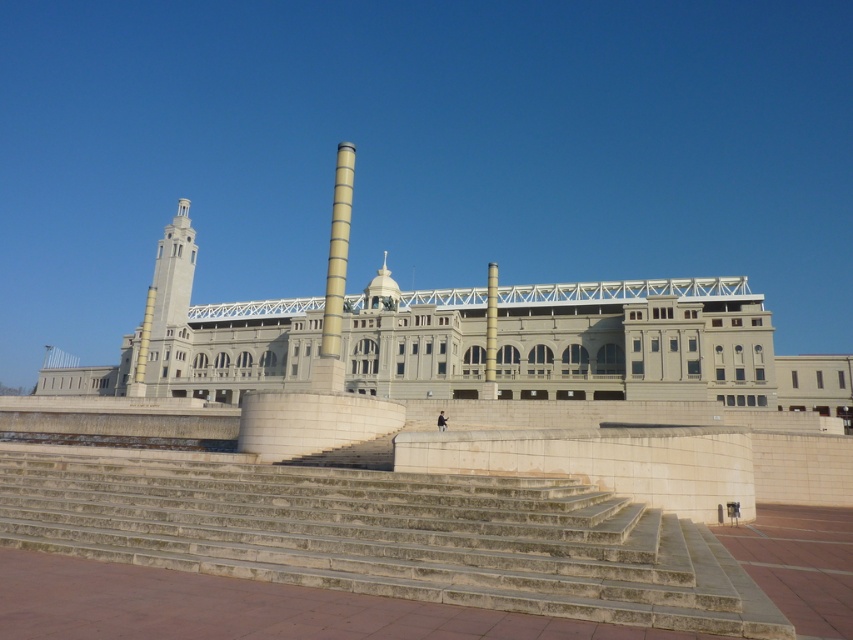
You are standing at the base of the stone steps leading to the historic building and want to take a photo that includes both the point at coordinates point (844,362) and point (334,292). Which point will appear closer to the camera in your photo?

Point (334,292) will appear closer to the camera in the photo because it is physically closer to the camera than point (844,362), which is further away.